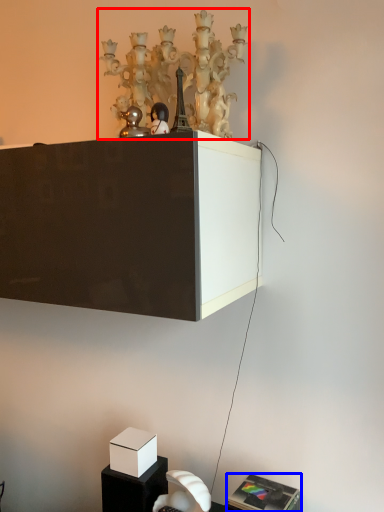
Question: Which object is further to the camera taking this photo, lamp (highlighted by a red box) or furniture (highlighted by a blue box)?

Choices:
 (A) lamp
 (B) furniture

Answer: (B)